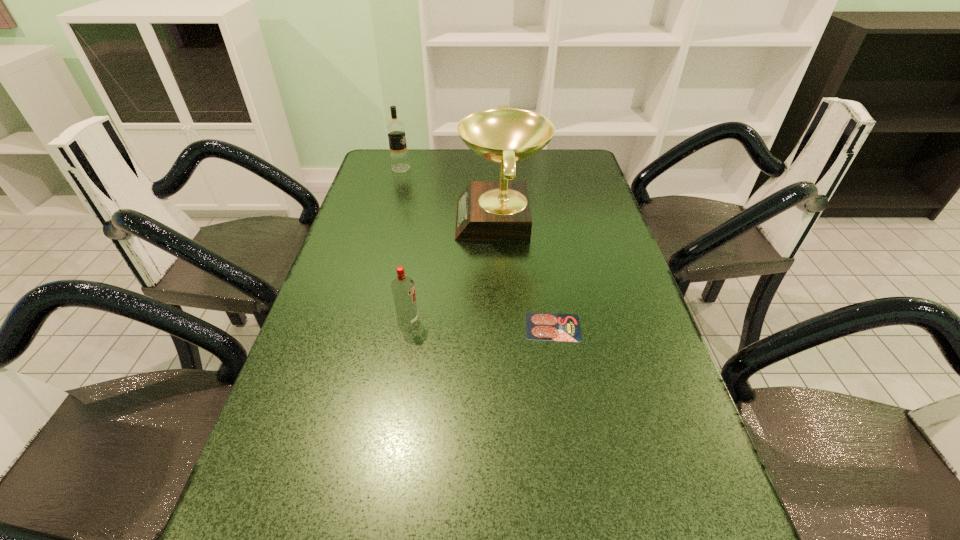
Where is `vacant space located on the label of the taller vodka`? This screenshot has height=540, width=960. vacant space located on the label of the taller vodka is located at coordinates (517, 168).

Image resolution: width=960 pixels, height=540 pixels. Identify the location of vacant space located 0.360m on the front label of the third object from right to left. (573, 321).

Identify the location of free spot located on the front of the shortest object. Image resolution: width=960 pixels, height=540 pixels. (578, 477).

This screenshot has width=960, height=540. In order to click on object that is positioned at the far edge in this screenshot , I will do `click(395, 129)`.

Locate an element on the screen. object situated at the left edge is located at coordinates (395, 129).

Identify the location of object at the far left corner. This screenshot has height=540, width=960. (395, 129).

You are a GUI agent. You are given a task and a screenshot of the screen. Output one action in this format:
    pyautogui.click(x=<x>, y=<y>)
    Task: Click on the vacant space at the far edge of the desktop
    This screenshot has width=960, height=540.
    Given the screenshot: What is the action you would take?
    pyautogui.click(x=478, y=165)

Identify the location of vacant space at the left edge of the desktop. (234, 525).

Find the location of `free space at the right edge`. free space at the right edge is located at coordinates (565, 238).

Find the location of a particular element. blank area at the far right corner is located at coordinates (551, 151).